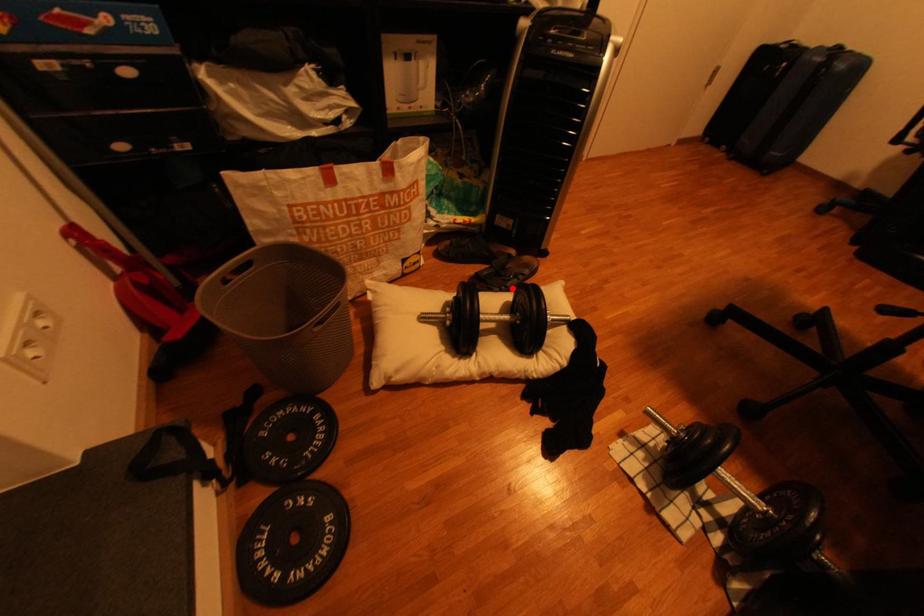
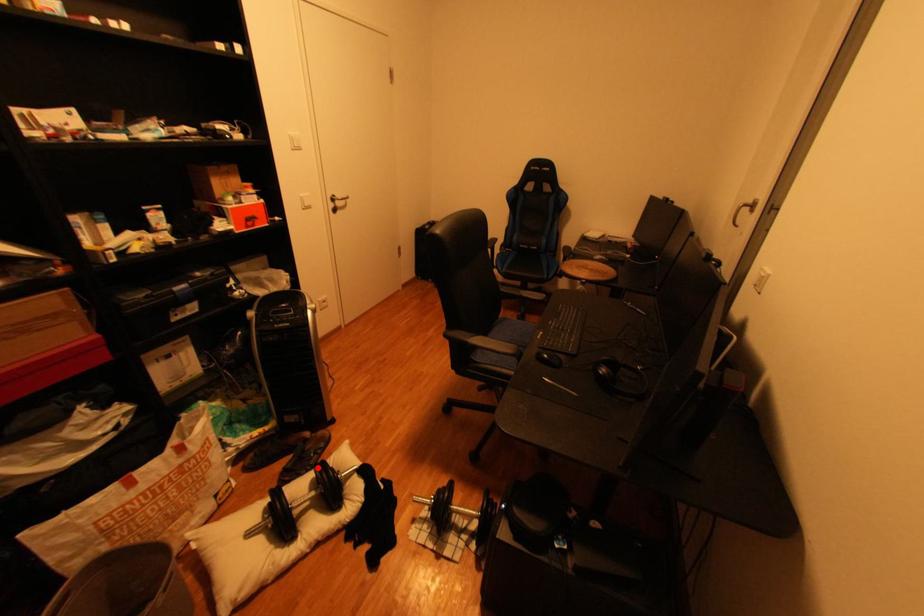
I am providing you with two images of the same scene from different viewpoints. A red point is marked on the first image and another point is marked on the second image. Does the point marked in image1 correspond to the same location as the one in image2?

Yes